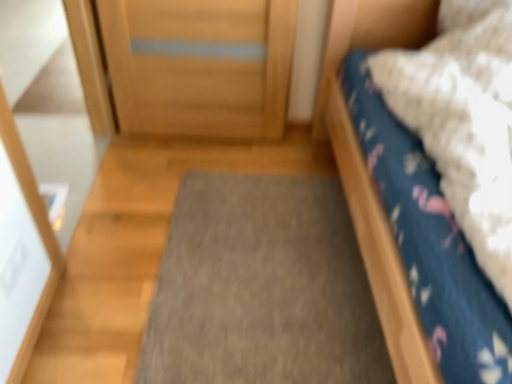
The image size is (512, 384). Describe the element at coordinates (368, 170) in the screenshot. I see `blue cotton bed at right` at that location.

Where is `blue cotton bed at right`? This screenshot has width=512, height=384. blue cotton bed at right is located at coordinates (368, 170).

What do you see at coordinates (262, 287) in the screenshot? The image size is (512, 384). I see `gray carpet at center` at bounding box center [262, 287].

In order to face gray carpet at center, should I rotate leftwards or rightwards?

Rotate your view right by about 1.591°.

Locate an element on the screen. gray carpet at center is located at coordinates (262, 287).

At what (x,y) coordinates should I click in order to perform the action: click on blue cotton bed at right. Please return your answer as a coordinate pair (x, y). Image resolution: width=512 pixels, height=384 pixels. Looking at the image, I should click on (368, 170).

Does blue cotton bed at right appear on the left side of gray carpet at center?

No, blue cotton bed at right is not to the left of gray carpet at center.

In the image, is blue cotton bed at right positioned in front of or behind gray carpet at center?

Visually, blue cotton bed at right is located in front of gray carpet at center.

Between point (362, 202) and point (334, 274), which one is positioned behind?

The point (334, 274) is farther.

From the image's perspective, is blue cotton bed at right above gray carpet at center?

Yes.

From a real-world perspective, is blue cotton bed at right positioned above or below gray carpet at center?

Clearly, from a real-world perspective, blue cotton bed at right is above gray carpet at center.

Can you confirm if blue cotton bed at right is wider than gray carpet at center?

Yes, blue cotton bed at right is wider than gray carpet at center.

Does blue cotton bed at right have a greater height compared to gray carpet at center?

Correct, blue cotton bed at right is much taller as gray carpet at center.

Between blue cotton bed at right and gray carpet at center, which one has smaller size?

Smaller between the two is gray carpet at center.

Could gray carpet at center be considered to be inside blue cotton bed at right?

No, blue cotton bed at right does not contain gray carpet at center.

Is there a large distance between blue cotton bed at right and gray carpet at center?

No, blue cotton bed at right is not far away from gray carpet at center.

Is blue cotton bed at right facing towards gray carpet at center?

No, blue cotton bed at right is not facing towards gray carpet at center.

What's the angular difference between blue cotton bed at right and gray carpet at center's facing directions?

There is a 86.6-degree angle between the facing directions of blue cotton bed at right and gray carpet at center.

How much distance is there between blue cotton bed at right and gray carpet at center?

They are 40.59 centimeters apart.

The image size is (512, 384). Identify the location of bed in front of the gray carpet at center. (368, 170).

Which is more to the left, gray carpet at center or blue cotton bed at right?

From the viewer's perspective, gray carpet at center appears more on the left side.

Is gray carpet at center in front of blue cotton bed at right?

No.

Does point (223, 305) lie behind point (399, 262)?

Yes.

From the image's perspective, is gray carpet at center located above blue cotton bed at right?

No, from the image's perspective, gray carpet at center is not over blue cotton bed at right.

From a real-world perspective, which object stands above the other?

blue cotton bed at right.

Considering the relative sizes of gray carpet at center and blue cotton bed at right in the image provided, is gray carpet at center wider than blue cotton bed at right?

No.

Considering the relative sizes of gray carpet at center and blue cotton bed at right in the image provided, is gray carpet at center taller than blue cotton bed at right?

In fact, gray carpet at center may be shorter than blue cotton bed at right.

Does gray carpet at center have a smaller size compared to blue cotton bed at right?

Correct, gray carpet at center occupies less space than blue cotton bed at right.

Is gray carpet at center located outside blue cotton bed at right?

That's correct, gray carpet at center is outside of blue cotton bed at right.

Are gray carpet at center and blue cotton bed at right located far from each other?

No, there isn't a large distance between gray carpet at center and blue cotton bed at right.

From the picture: Does gray carpet at center turn towards blue cotton bed at right?

Yes, gray carpet at center is oriented towards blue cotton bed at right.

How many degrees apart are the facing directions of gray carpet at center and blue cotton bed at right?

There is a 86.6-degree angle between the facing directions of gray carpet at center and blue cotton bed at right.

Locate an element on the screen. bed that is above the gray carpet at center (from a real-world perspective) is located at coordinates (368, 170).

Find the location of a particular element. doormat below the blue cotton bed at right (from the image's perspective) is located at coordinates (262, 287).

Identify the location of bed above the gray carpet at center (from a real-world perspective). The width and height of the screenshot is (512, 384). (368, 170).